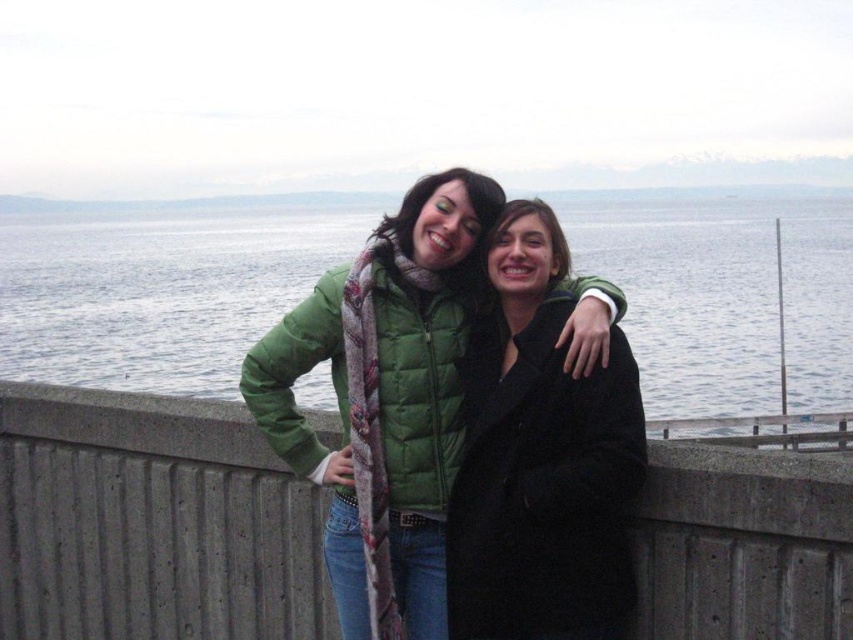
Between clear blue water at center and black wool coat at center, which one has less height?

With less height is black wool coat at center.

Does clear blue water at center appear over black wool coat at center?

Yes.

Which is behind, point (601, 234) or point (607, 394)?

Positioned behind is point (601, 234).

You are a GUI agent. You are given a task and a screenshot of the screen. Output one action in this format:
    pyautogui.click(x=<x>, y=<y>)
    Task: Click on the clear blue water at center
    The height and width of the screenshot is (640, 853).
    Given the screenshot: What is the action you would take?
    pyautogui.click(x=157, y=291)

Can you confirm if concrete at center is taller than green puffer jacket at center?

No, concrete at center is not taller than green puffer jacket at center.

Who is lower down, concrete at center or green puffer jacket at center?

concrete at center is lower down.

Is point (161, 628) behind point (325, 344)?

Yes, point (161, 628) is behind point (325, 344).

Identify the location of concrete at center. This screenshot has width=853, height=640. (151, 522).

Is clear blue water at center shorter than green puffer jacket at center?

Incorrect, clear blue water at center's height does not fall short of green puffer jacket at center's.

Between clear blue water at center and green puffer jacket at center, which one has more height?

clear blue water at center is taller.

Is point (236, 353) more distant than point (260, 364)?

Yes, it is.

Identify the location of clear blue water at center. pyautogui.click(x=157, y=291).